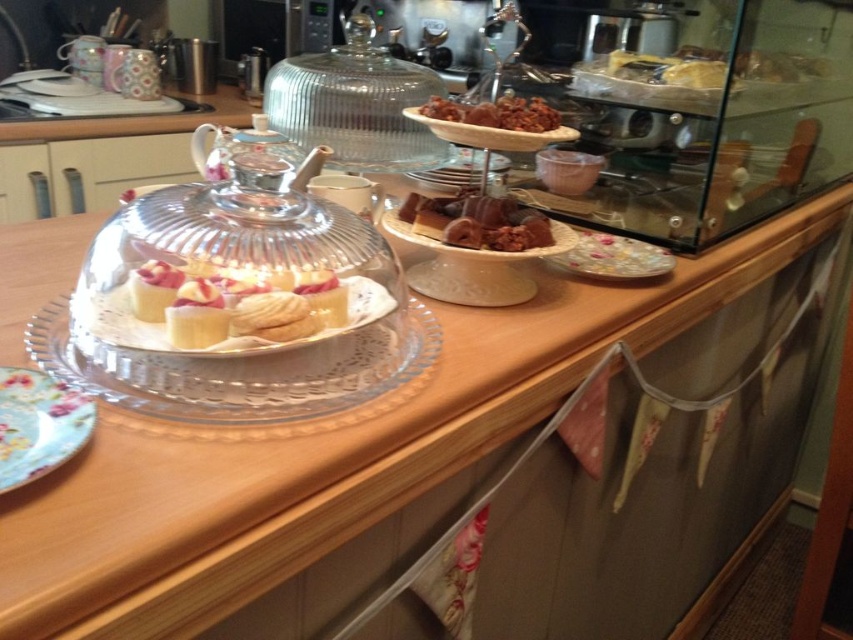
You are a guest at the tea party and want to place your dessert on the floral paper plate at lower left. The floral paper plate at lower left is located at coordinate point (38, 424). Can you determine if the floral paper plate at lower left is on the left or right side of the counter?

The floral paper plate at lower left is located at point (38, 424), which is on the left side of the counter.

You are planning to place a 10 cm wide cookie on the chocolate glossy cake at center or the porcelain plate at center. Based on their sizes, which object can accommodate the cookie without it hanging over the edge?

The porcelain plate at center has a greater width than the chocolate glossy cake at center, so the cookie can be placed on the porcelain plate at center without hanging over the edge.